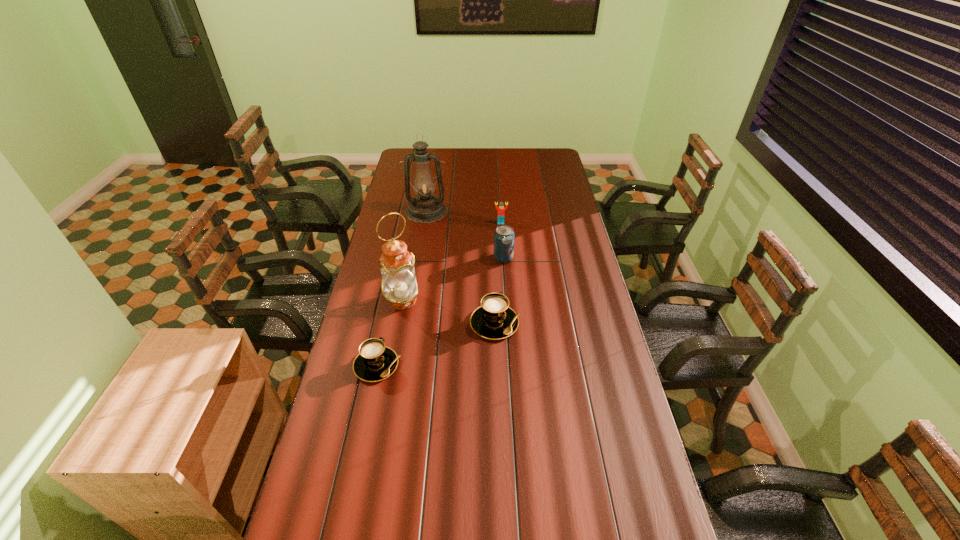
The cappuccinos are evenly distributed in the image. To maintain this, where would you place another cappuccino on the right? Please point to a free space. Please provide its 2D coordinates. Your answer should be formatted as a tuple, i.e. [(x, y)], where the tuple contains the x and y coordinates of a point satisfying the conditions above.

[(594, 288)]